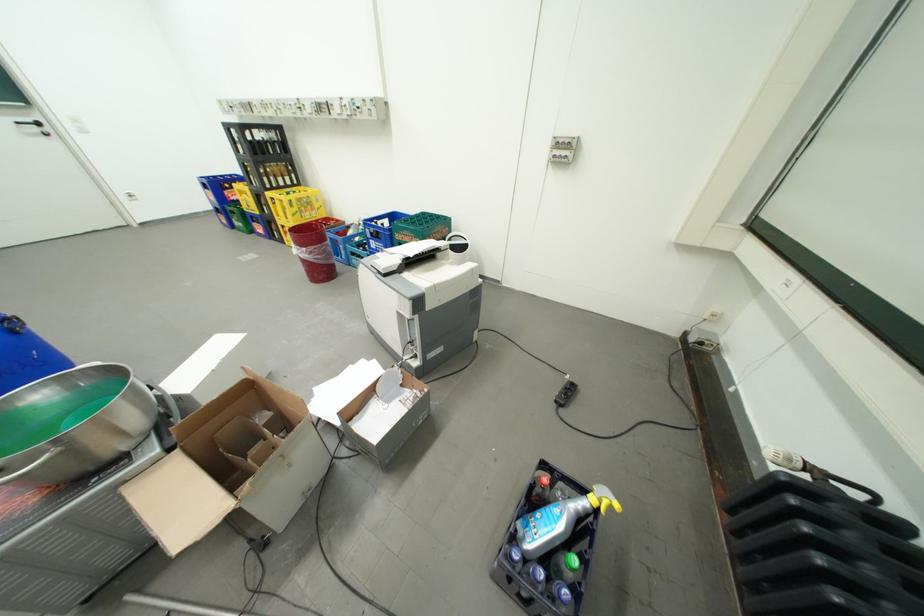
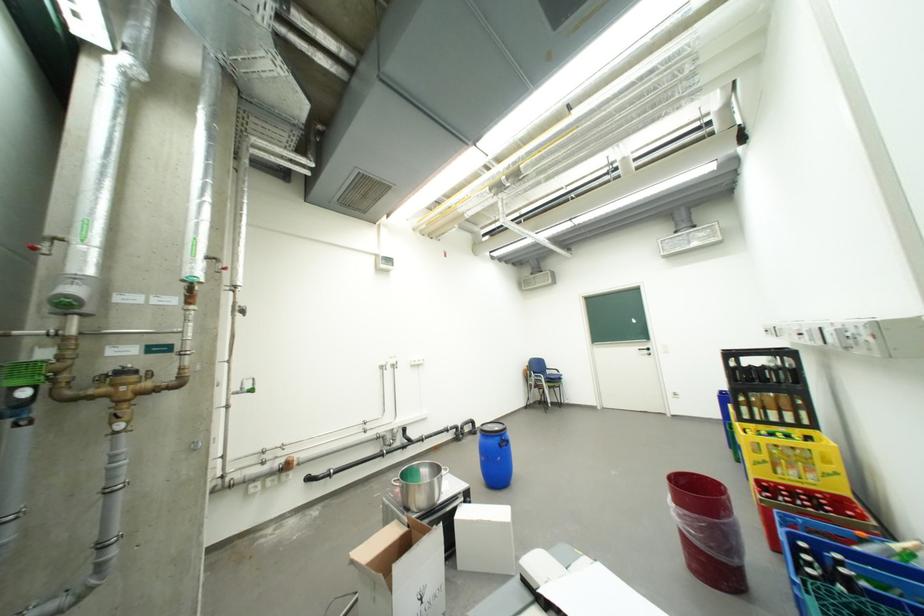
Where in the second image is the point corresponding to [224,369] from the first image?

(484, 520)